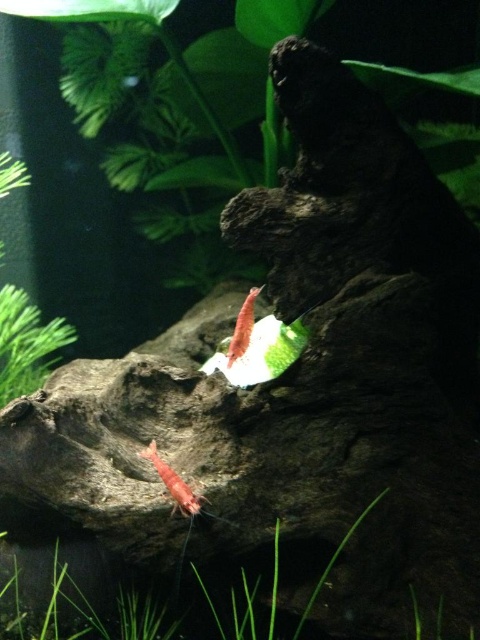
Does translucent red shrimp at center have a greater height compared to translucent pink shrimp at center?

No.

Which of these two, translucent red shrimp at center or translucent pink shrimp at center, stands taller?

translucent pink shrimp at center

Describe the element at coordinates (260, 353) in the screenshot. I see `translucent red shrimp at center` at that location.

The height and width of the screenshot is (640, 480). In order to click on translucent red shrimp at center in this screenshot , I will do `click(260, 353)`.

Measure the distance between point (x=379, y=620) and camera.

Point (x=379, y=620) and camera are 5.47 feet apart from each other.

Who is taller, green matte plant at lower center or translucent red shrimp at center?

green matte plant at lower center is taller.

At what (x,y) coordinates should I click in order to perform the action: click on green matte plant at lower center. Please return your answer as a coordinate pair (x, y). The width and height of the screenshot is (480, 640). Looking at the image, I should click on (337, 582).

Locate an element on the screen. This screenshot has width=480, height=640. green matte plant at lower center is located at coordinates (337, 582).

Which is in front, point (1, 246) or point (245, 349)?

Point (245, 349)

Locate an element on the screen. The width and height of the screenshot is (480, 640). green matte plant at upper left is located at coordinates (25, 342).

At what (x,y) coordinates should I click in order to perform the action: click on green matte plant at upper left. Please return your answer as a coordinate pair (x, y). This screenshot has height=640, width=480. Looking at the image, I should click on (25, 342).